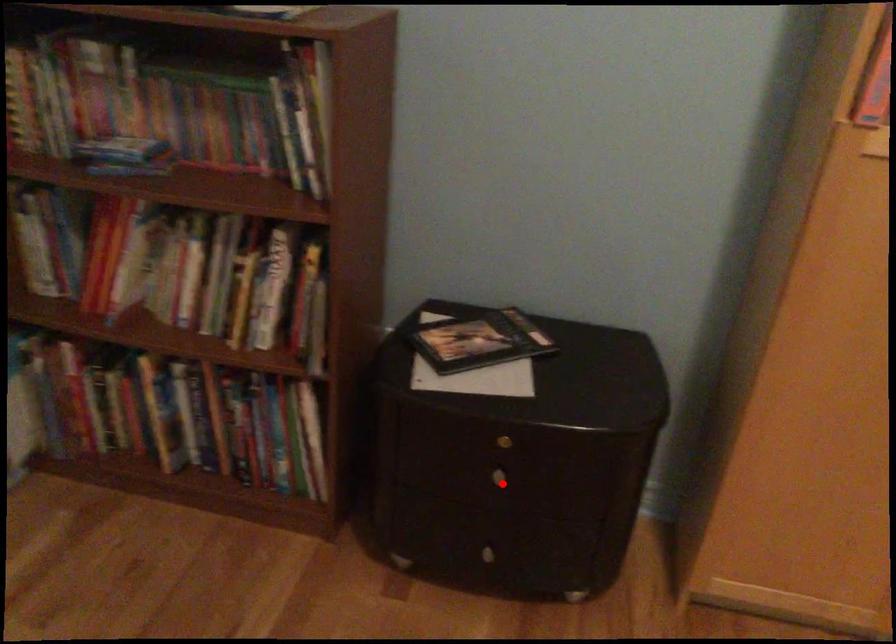
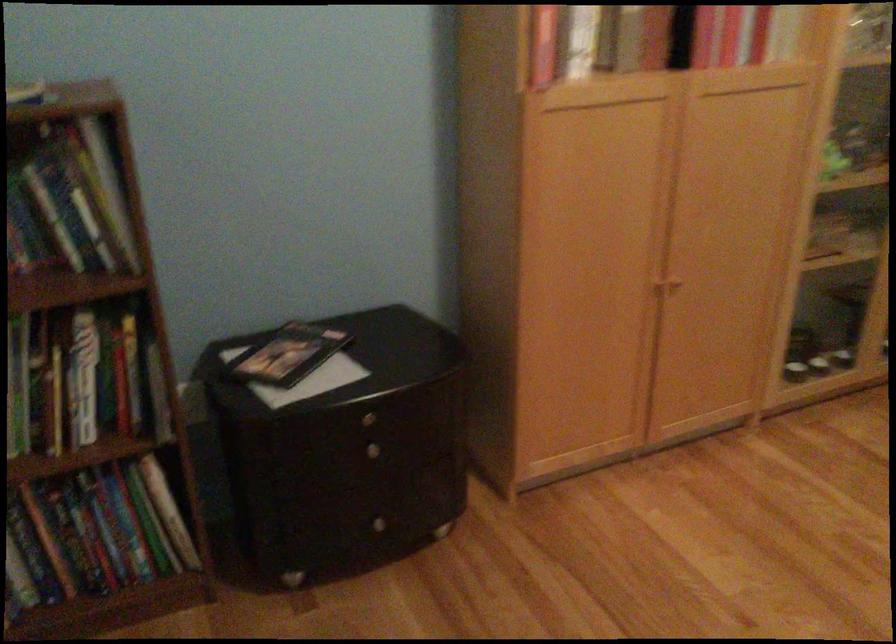
Question: I am providing you with two images of the same scene from different viewpoints. Image1 has a red point marked. In image2, the corresponding 3D location appears at what relative position? Reply with the corresponding letter.

Choices:
 (A) Closer
 (B) Farther

Answer: (B)